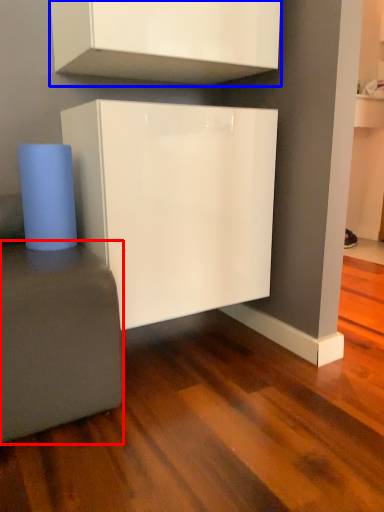
Question: Among these objects, which one is farthest to the camera, furniture (highlighted by a red box) or cabinetry (highlighted by a blue box)?

Choices:
 (A) furniture
 (B) cabinetry

Answer: (B)